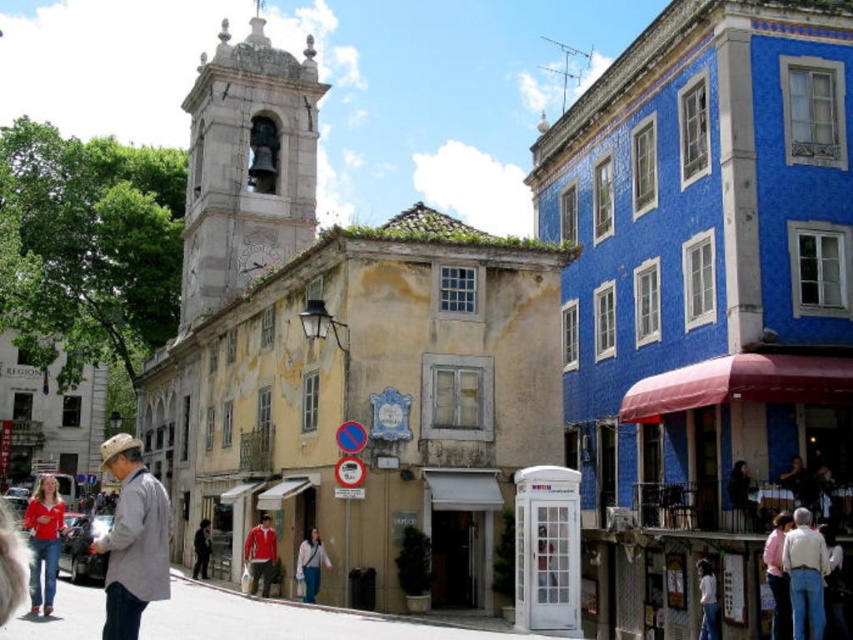
Question: Where is gray cotton jacket at lower left located in relation to pink fabric shirt at lower right in the image?

Choices:
 (A) above
 (B) below

Answer: (B)

Question: Which object is positioned farthest from the light beige sweater at center?

Choices:
 (A) gray cotton jacket at lower left
 (B) dark gray jacket at lower left
 (C) dark brown leather jacket at lower right

Answer: (C)

Question: Which object is farther from the camera taking this photo?

Choices:
 (A) pink fabric shirt at lower right
 (B) red fabric jacket at center
 (C) denim jacket at lower right
 (D) matte red shirt at lower left

Answer: (B)

Question: Which object is positioned closest to the light beige sweater at center?

Choices:
 (A) white cotton shirt at lower right
 (B) denim jacket at lower right
 (C) dark gray jacket at lower left
 (D) dark brown leather jacket at lower right

Answer: (C)

Question: Does gray cotton jacket at lower left appear under red fabric jacket at center?

Choices:
 (A) yes
 (B) no

Answer: (A)

Question: Does light beige sweater at center have a larger size compared to white cotton shirt at lower right?

Choices:
 (A) yes
 (B) no

Answer: (A)